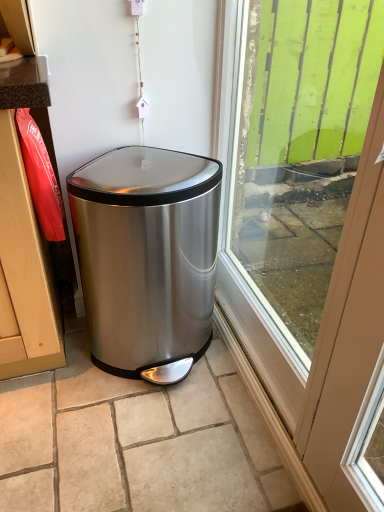
Question: Is green wood at right thinner than polished stainless steel trash can at center?

Choices:
 (A) yes
 (B) no

Answer: (A)

Question: Could you tell me if green wood at right is turned towards polished stainless steel trash can at center?

Choices:
 (A) no
 (B) yes

Answer: (B)

Question: From the image's perspective, is green wood at right on top of polished stainless steel trash can at center?

Choices:
 (A) yes
 (B) no

Answer: (A)

Question: From the image's perspective, would you say green wood at right is shown under polished stainless steel trash can at center?

Choices:
 (A) yes
 (B) no

Answer: (B)

Question: Is green wood at right outside of polished stainless steel trash can at center?

Choices:
 (A) no
 (B) yes

Answer: (B)

Question: From a real-world perspective, is green wood at right located beneath polished stainless steel trash can at center?

Choices:
 (A) yes
 (B) no

Answer: (B)

Question: Is there a large distance between polished stainless steel trash can at center and green wood at right?

Choices:
 (A) yes
 (B) no

Answer: (B)

Question: Are polished stainless steel trash can at center and green wood at right beside each other?

Choices:
 (A) yes
 (B) no

Answer: (B)

Question: From a real-world perspective, is polished stainless steel trash can at center over green wood at right?

Choices:
 (A) yes
 (B) no

Answer: (B)

Question: Is polished stainless steel trash can at center completely or partially outside of green wood at right?

Choices:
 (A) no
 (B) yes

Answer: (B)

Question: Does polished stainless steel trash can at center have a greater height compared to green wood at right?

Choices:
 (A) no
 (B) yes

Answer: (A)

Question: From the image's perspective, is polished stainless steel trash can at center below green wood at right?

Choices:
 (A) yes
 (B) no

Answer: (A)

Question: Considering the positions of green wood at right and polished stainless steel trash can at center in the image, is green wood at right bigger or smaller than polished stainless steel trash can at center?

Choices:
 (A) small
 (B) big

Answer: (A)